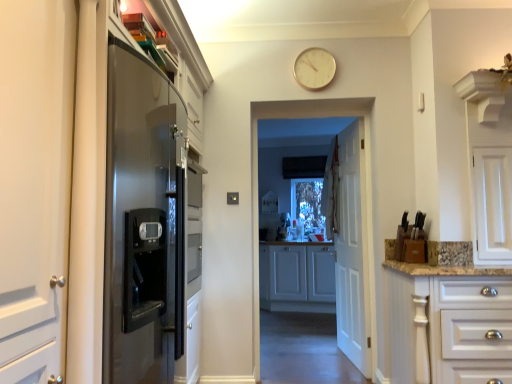
This screenshot has width=512, height=384. In order to click on vacant point to the left of white wooden door at center in this screenshot , I will do `click(301, 355)`.